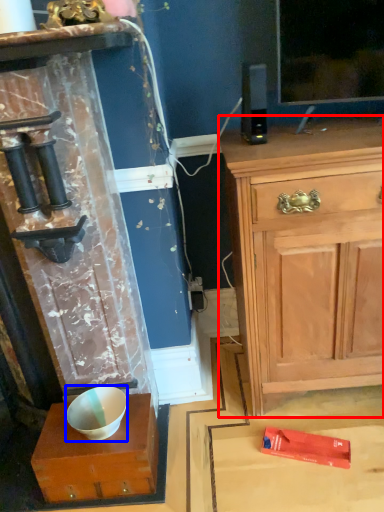
Question: Which point is further to the camera, chest of drawers (highlighted by a red box) or bowl (highlighted by a blue box)?

Choices:
 (A) chest of drawers
 (B) bowl

Answer: (B)